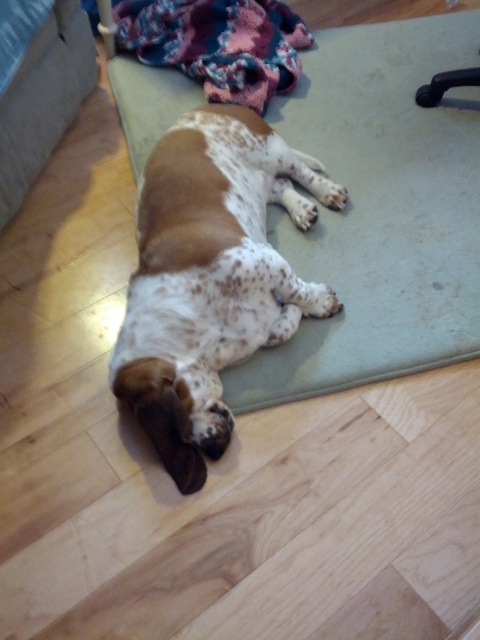
Can you confirm if green rubber yoga mat at center is positioned above speckled fur dog at center?

Correct, green rubber yoga mat at center is located above speckled fur dog at center.

Does green rubber yoga mat at center appear on the left side of speckled fur dog at center?

In fact, green rubber yoga mat at center is to the right of speckled fur dog at center.

Where is `green rubber yoga mat at center`? The width and height of the screenshot is (480, 640). green rubber yoga mat at center is located at coordinates (380, 211).